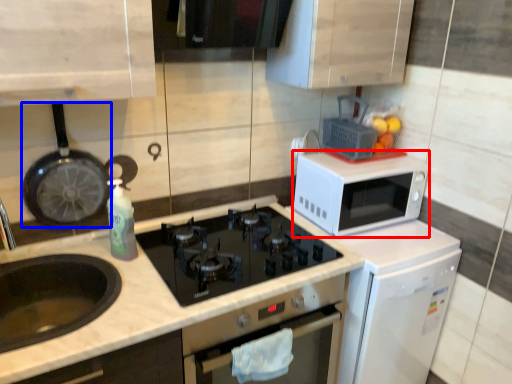
Question: Among these objects, which one is farthest to the camera, microwave oven (highlighted by a red box) or frying pan (highlighted by a blue box)?

Choices:
 (A) microwave oven
 (B) frying pan

Answer: (A)